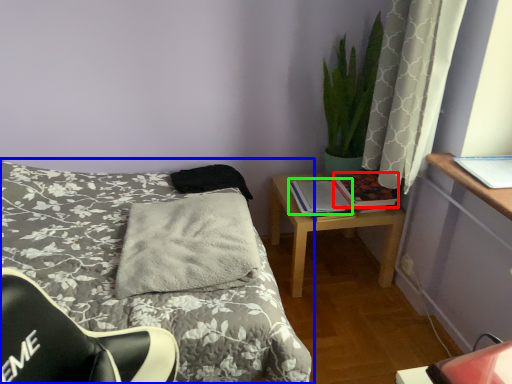
Question: Which object is the farthest from book (highlighted by a red box)? Choose among these: bed (highlighted by a blue box) or book (highlighted by a green box).

Choices:
 (A) bed
 (B) book

Answer: (A)